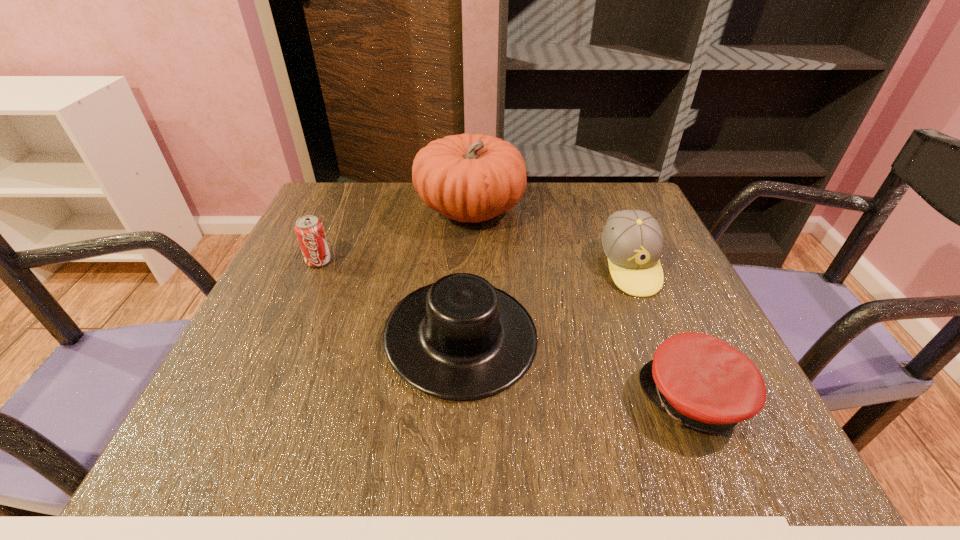
You are a GUI agent. You are given a task and a screenshot of the screen. Output one action in this format:
    pyautogui.click(x=<x>, y=<y>)
    Task: Click on the vacant region at the left edge of the desktop
    
    Given the screenshot: What is the action you would take?
    [255, 393]

I want to click on blank area at the far left corner, so click(329, 182).

I want to click on free space at the far right corner of the desktop, so click(x=592, y=208).

Where is `vacant area that lies between the dress hat and the soda can`? The height and width of the screenshot is (540, 960). vacant area that lies between the dress hat and the soda can is located at coordinates (390, 299).

What are the coordinates of `vacant area that lies between the leftmost object and the pumpkin` in the screenshot? It's located at (395, 235).

The image size is (960, 540). I want to click on vacant area that lies between the pumpkin and the soda can, so click(x=395, y=235).

I want to click on free spot between the tallest object and the cap, so click(582, 305).

Identify the location of free space that is in between the baseball cap and the soda can. (474, 264).

Where is `vacant area between the dress hat and the tallest object`? This screenshot has width=960, height=540. vacant area between the dress hat and the tallest object is located at coordinates (466, 273).

Find the location of a particular element. free space between the soda can and the pumpkin is located at coordinates (395, 235).